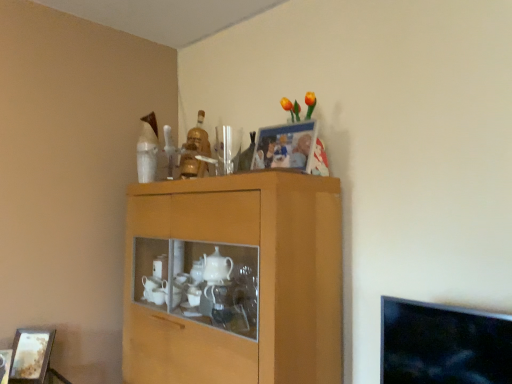
Question: Does wooden picture frame at lower left, which appears as the second picture frame when viewed from the right, appear on the right side of matte plastic picture frame at upper center, the first picture frame viewed from the top?

Choices:
 (A) yes
 (B) no

Answer: (B)

Question: From the image's perspective, would you say wooden picture frame at lower left, the 1th picture frame viewed from the left, is positioned over matte plastic picture frame at upper center, the 1th picture frame viewed from the front?

Choices:
 (A) yes
 (B) no

Answer: (B)

Question: Does wooden picture frame at lower left, arranged as the 1th picture frame when ordered from the bottom, turn towards matte plastic picture frame at upper center, the first picture frame viewed from the top?

Choices:
 (A) yes
 (B) no

Answer: (B)

Question: Is wooden picture frame at lower left, the 1th picture frame viewed from the left, positioned before matte plastic picture frame at upper center, the 1th picture frame positioned from the right?

Choices:
 (A) no
 (B) yes

Answer: (A)

Question: From the image's perspective, does wooden picture frame at lower left, which appears as the second picture frame when viewed from the right, appear lower than matte plastic picture frame at upper center, which ranks as the 2th picture frame in back-to-front order?

Choices:
 (A) yes
 (B) no

Answer: (A)

Question: Considering the relative sizes of wooden picture frame at lower left, which appears as the second picture frame when viewed from the right, and matte plastic picture frame at upper center, placed as the 2th picture frame when sorted from bottom to top, in the image provided, is wooden picture frame at lower left, which appears as the second picture frame when viewed from the right, bigger than matte plastic picture frame at upper center, placed as the 2th picture frame when sorted from bottom to top,?

Choices:
 (A) no
 (B) yes

Answer: (A)

Question: Considering the relative positions of wooden cabinet at center and matte plastic picture frame at upper center, arranged as the second picture frame when viewed from the left, in the image provided, is wooden cabinet at center to the right of matte plastic picture frame at upper center, arranged as the second picture frame when viewed from the left, from the viewer's perspective?

Choices:
 (A) no
 (B) yes

Answer: (A)

Question: Can you confirm if wooden cabinet at center is taller than matte plastic picture frame at upper center, placed as the 2th picture frame when sorted from bottom to top?

Choices:
 (A) yes
 (B) no

Answer: (A)

Question: Does wooden cabinet at center have a greater width compared to matte plastic picture frame at upper center, placed as the 2th picture frame when sorted from bottom to top?

Choices:
 (A) yes
 (B) no

Answer: (A)

Question: From the image's perspective, is wooden cabinet at center located beneath matte plastic picture frame at upper center, placed as the 2th picture frame when sorted from bottom to top?

Choices:
 (A) yes
 (B) no

Answer: (A)

Question: Can you confirm if wooden cabinet at center is positioned to the left of matte plastic picture frame at upper center, placed as the 2th picture frame when sorted from bottom to top?

Choices:
 (A) yes
 (B) no

Answer: (A)

Question: From a real-world perspective, is wooden cabinet at center below matte plastic picture frame at upper center, the first picture frame viewed from the top?

Choices:
 (A) no
 (B) yes

Answer: (B)

Question: From the image's perspective, is wooden cabinet at center located beneath wooden picture frame at lower left, arranged as the second picture frame when viewed from the top?

Choices:
 (A) yes
 (B) no

Answer: (B)